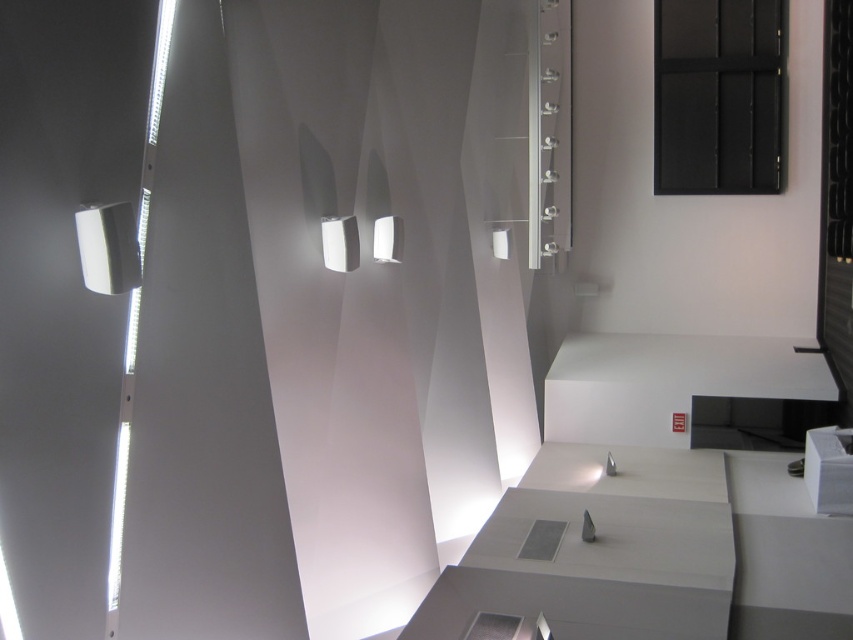
Does white glossy wall sconce at upper left appear on the right side of white glossy light at center?

Incorrect, white glossy wall sconce at upper left is not on the right side of white glossy light at center.

This screenshot has height=640, width=853. What do you see at coordinates (108, 248) in the screenshot? I see `white glossy wall sconce at upper left` at bounding box center [108, 248].

Which is in front, point (112, 262) or point (383, 260)?

Point (112, 262) is more forward.

Identify the location of white glossy wall sconce at upper left. (108, 248).

Does white glossy rectangular light at center appear on the right side of white glossy light at center?

In fact, white glossy rectangular light at center is to the left of white glossy light at center.

Locate an element on the screen. Image resolution: width=853 pixels, height=640 pixels. white glossy rectangular light at center is located at coordinates (339, 243).

Which is behind, point (112, 248) or point (334, 257)?

Positioned behind is point (334, 257).

Does white glossy wall sconce at upper left have a greater width compared to white glossy rectangular light at center?

Yes, white glossy wall sconce at upper left is wider than white glossy rectangular light at center.

Does point (91, 241) come farther from viewer compared to point (323, 243)?

No, (91, 241) is in front of (323, 243).

The height and width of the screenshot is (640, 853). In order to click on white glossy wall sconce at upper left in this screenshot , I will do `click(108, 248)`.